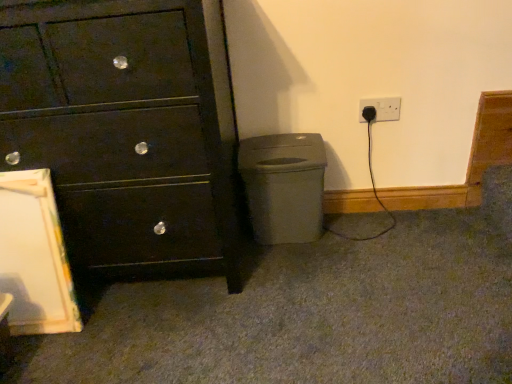
Image resolution: width=512 pixels, height=384 pixels. Find the location of `free spot to the right of matte black chest of drawers at left`. free spot to the right of matte black chest of drawers at left is located at coordinates (339, 288).